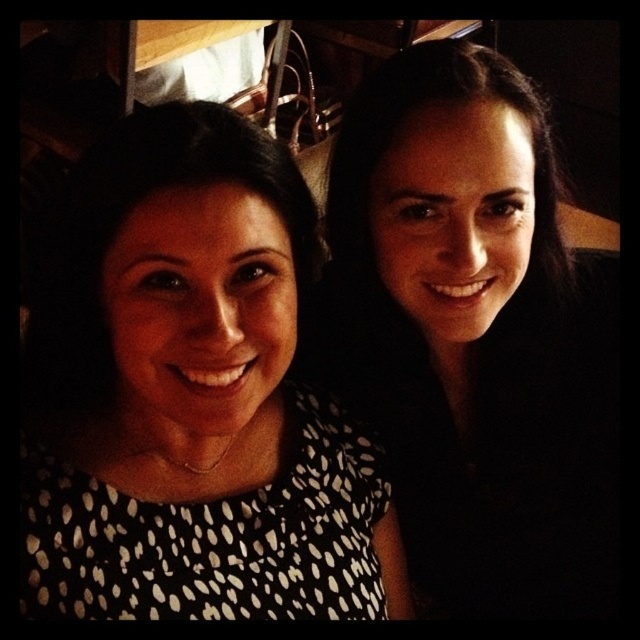
You are a photographer trying to capture a closeup shot of the white dotted dress at center and the black dotted dress at upper right. The camera you are using has a maximum focus range of 8 inches. Can you fit both dresses within the focus range?

The white dotted dress at center and black dotted dress at upper right are 7.84 inches apart. Since the distance between them is less than the camera maximum focus range of 8 inches, both dresses can be captured within the focus range.

You are a photographer trying to position two models wearing the white dotted dress at center and the black dotted dress at upper right. Based on the scene, which dress is positioned to the left of the other?

The white dotted dress at center is positioned to the left of the black dotted dress at upper right.

You are a photographer setting up for a photoshoot. You have two dresses displayed in the scene. The white dotted dress at center and the black dotted dress at upper right. Which dress has a narrower silhouette?

The white dotted dress at center has a narrower silhouette than the black dotted dress at upper right because it is thinner.